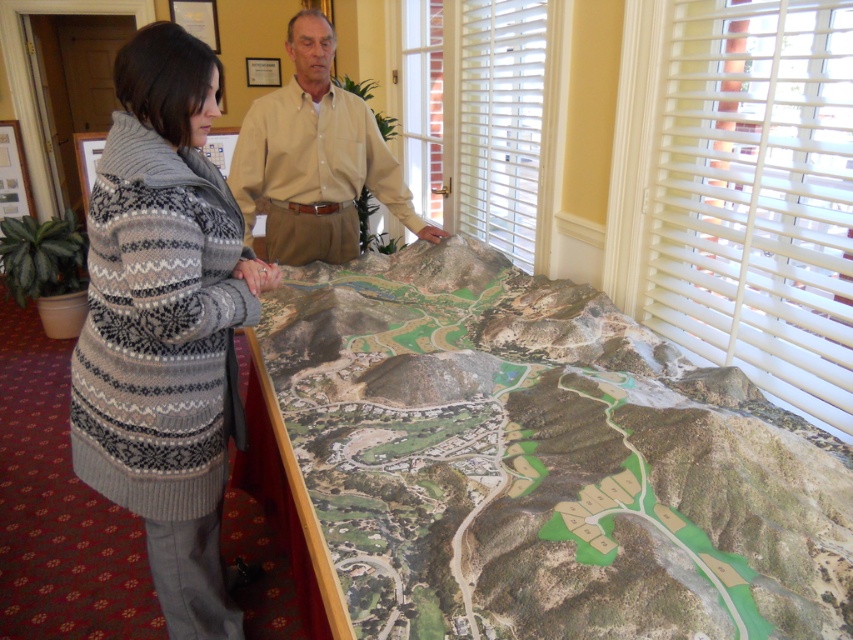
Question: Which point is farther to the camera?

Choices:
 (A) (254, 444)
 (B) (383, 186)
 (C) (746, 68)
 (D) (119, 113)

Answer: (B)

Question: Is knitted wool coat at left below beige cotton shirt at upper center?

Choices:
 (A) yes
 (B) no

Answer: (A)

Question: Which is nearer to the white wood blinds at upper right?

Choices:
 (A) white plastic blinds at upper right
 (B) green textured map at center
 (C) beige cotton shirt at upper center

Answer: (C)

Question: Observing the image, what is the correct spatial positioning of green textured map at center in reference to knitted wool coat at left?

Choices:
 (A) right
 (B) left

Answer: (A)

Question: Which point is farther from the camera taking this photo?

Choices:
 (A) (477, 100)
 (B) (811, 365)
 (C) (352, 138)
 (D) (158, 458)

Answer: (A)

Question: Is white plastic blinds at upper right bigger than white wood blinds at upper right?

Choices:
 (A) yes
 (B) no

Answer: (A)